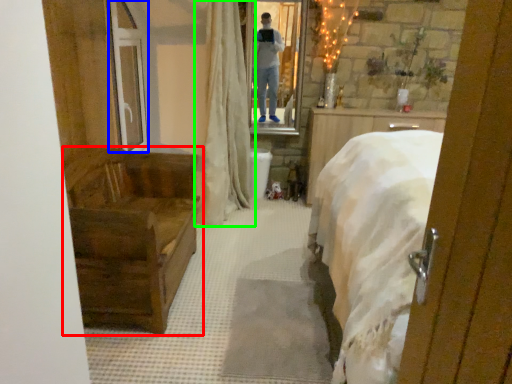
Question: Considering the real-world distances, which object is farthest from furniture (highlighted by a red box)? glass door (highlighted by a blue box) or curtain (highlighted by a green box)?

Choices:
 (A) glass door
 (B) curtain

Answer: (B)